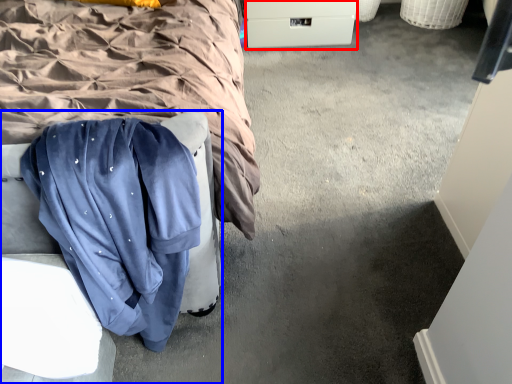
Question: Among these objects, which one is farthest to the camera, drawer (highlighted by a red box) or furniture (highlighted by a blue box)?

Choices:
 (A) drawer
 (B) furniture

Answer: (A)